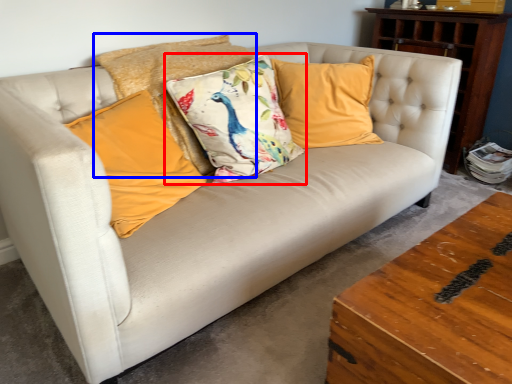
Question: Which of the following is the closest to the observer, pillow (highlighted by a red box) or pillow (highlighted by a blue box)?

Choices:
 (A) pillow
 (B) pillow

Answer: (A)